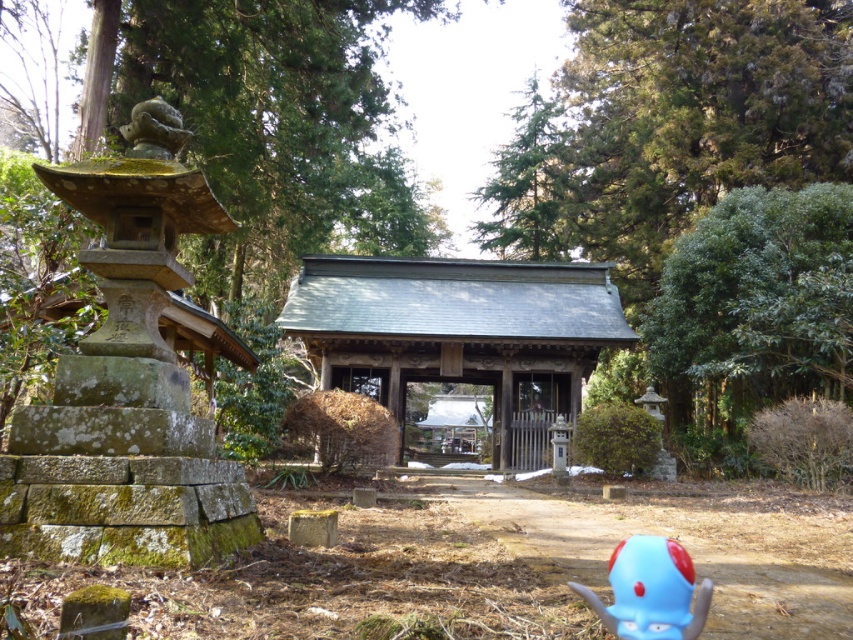
Question: Among these objects, which one is nearest to the camera?

Choices:
 (A) mossy stone lantern at left
 (B) green coniferous tree at upper center

Answer: (A)

Question: Which of the following is the farthest from the observer?

Choices:
 (A) gray/wooden hut at center
 (B) green leafy tree at right
 (C) green coniferous tree at upper center
 (D) blue rubber toy at lower right

Answer: (C)

Question: Is gray/wooden hut at center positioned before green leafy tree at right?

Choices:
 (A) no
 (B) yes

Answer: (A)

Question: Which of the following is the farthest from the observer?

Choices:
 (A) gray/wooden hut at center
 (B) green leafy tree at right

Answer: (A)

Question: Does green leafy tree at right have a larger size compared to green coniferous tree at upper center?

Choices:
 (A) no
 (B) yes

Answer: (A)

Question: Is gray/wooden hut at center smaller than blue rubber toy at lower right?

Choices:
 (A) yes
 (B) no

Answer: (B)